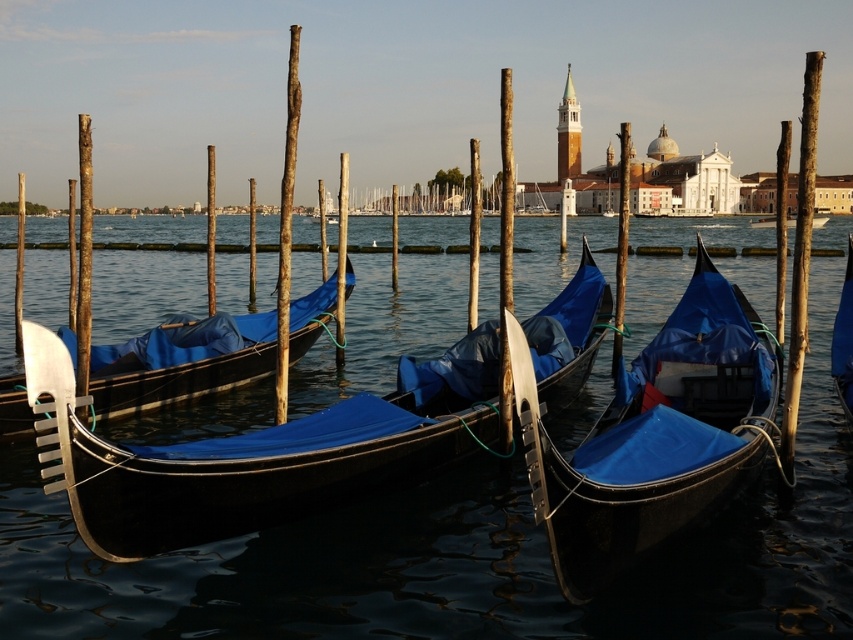
Question: Is brown wood pole at center positioned at the back of shiny blue canoe at center?

Choices:
 (A) no
 (B) yes

Answer: (A)

Question: Does brown wood pole at center lie in front of wooden pole at left?

Choices:
 (A) no
 (B) yes

Answer: (B)

Question: Among these points, which one is nearest to the camera?

Choices:
 (A) (503, 346)
 (B) (91, 248)
 (C) (839, 301)
 (D) (701, 364)

Answer: (A)

Question: Which of the following is the farthest from the observer?

Choices:
 (A) wooden pole at left
 (B) matte black canoe at center
 (C) blue tarp-covered canoe at center
 (D) shiny blue canoe at center

Answer: (D)

Question: Which point is closer to the camera?

Choices:
 (A) (91, 192)
 (B) (837, 385)
 (C) (91, 388)

Answer: (B)

Question: Does matte black canoe at center have a larger size compared to brown rough wood pole at center?

Choices:
 (A) yes
 (B) no

Answer: (B)